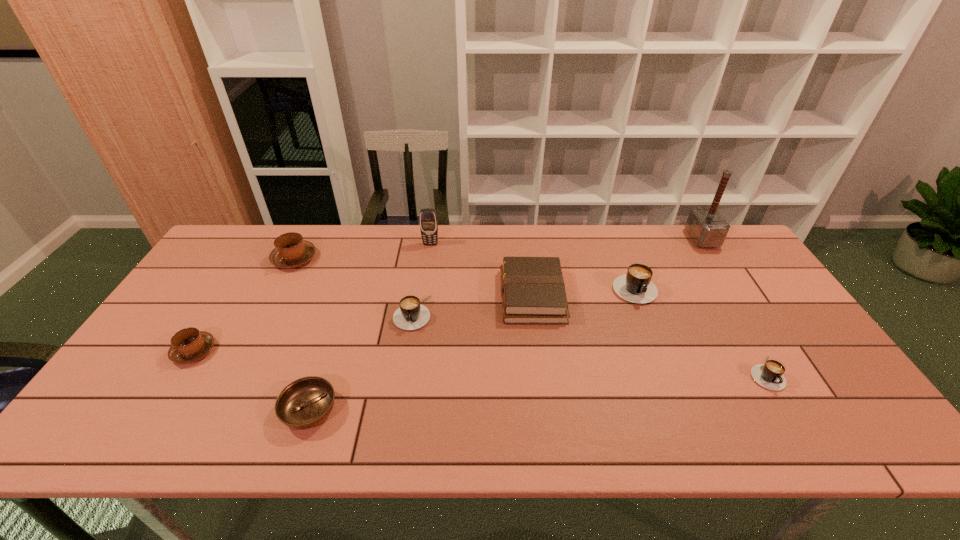
Identify the location of free space between the hammer and the third object from left to right. The height and width of the screenshot is (540, 960). (506, 325).

The height and width of the screenshot is (540, 960). I want to click on free space between the tallest object and the Bible, so click(x=617, y=267).

Identify the location of vacant space that's between the third object from left to right and the second biggest black cappuccino. This screenshot has height=540, width=960. (361, 362).

Identify the location of blank region between the Bible and the leftmost cappuccino. (363, 323).

Locate an element on the screen. This screenshot has height=540, width=960. vacant point located between the brown hammer and the rightmost black cappuccino is located at coordinates (733, 306).

Where is `free space between the fourth object from right to left and the seventh object from right to left`? free space between the fourth object from right to left and the seventh object from right to left is located at coordinates click(420, 353).

Find the location of a particular element. free space between the leftmost black cappuccino and the rightmost cappuccino is located at coordinates click(x=588, y=343).

Identify the location of object that is the second closest one to the left brown cappuccino. Image resolution: width=960 pixels, height=540 pixels. (291, 251).

Select which object appears as the third closest to the second cappuccino from left to right. Please provide its 2D coordinates. Your answer should be formatted as a tuple, i.e. [(x, y)], where the tuple contains the x and y coordinates of a point satisfying the conditions above.

[(428, 219)]

The height and width of the screenshot is (540, 960). I want to click on cappuccino that is the third closest one to the leftmost black cappuccino, so click(635, 286).